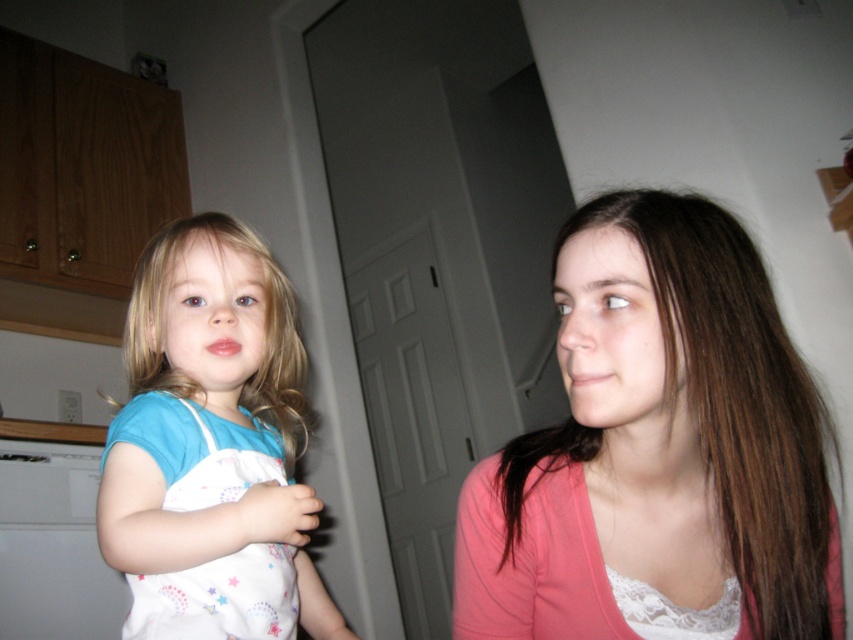
You are organizing a clothing storage system and need to determine which item requires more horizontal space. Based on the image, which item between the pink fabric at center and the white cotton dress at left takes up more width?

The pink fabric at center has a larger width than the white cotton dress at left, so it requires more horizontal space.

You are standing in the kitchen and need to place two decorative plates on the wall. The first plate must be placed at point (733, 317) and the second at point (206, 372). Which plate will be closer to your eyes when you look at them from where you are standing?

The plate placed at point (733, 317) will be closer to your eyes because it is closer to the viewer than point (206, 372).

You are standing in a room and see the pink fabric at center and the white cotton dress at left. Which object is nearer to you?

The pink fabric at center is closer to the viewer than the white cotton dress at left.